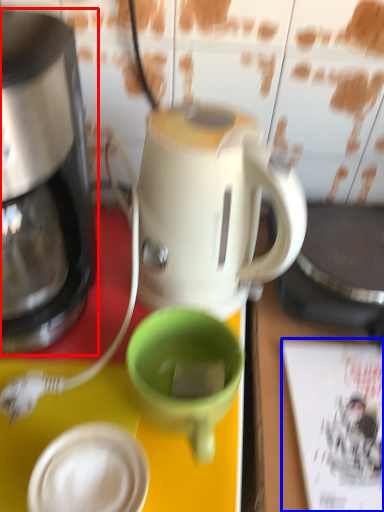
Question: Which object appears farthest to the camera in this image, coffee maker (highlighted by a red box) or magazine (highlighted by a blue box)?

Choices:
 (A) coffee maker
 (B) magazine

Answer: (B)